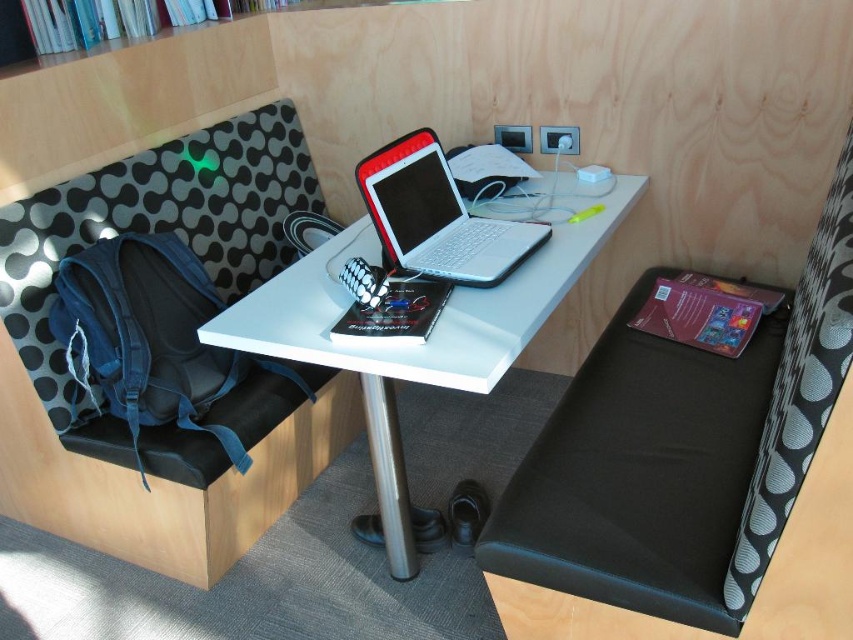
Question: Which of the following is the closest to the observer?

Choices:
 (A) (173, 202)
 (B) (616, 412)

Answer: (B)

Question: Which point is farther from the camera taking this photo?

Choices:
 (A) (814, 292)
 (B) (344, 228)
 (C) (103, 525)

Answer: (B)

Question: Can you confirm if black leather chair at lower right is bigger than white glossy computer desk at center?

Choices:
 (A) yes
 (B) no

Answer: (B)

Question: Is denim backpack at left closer to the viewer compared to black leather chair at lower right?

Choices:
 (A) yes
 (B) no

Answer: (B)

Question: Among these points, which one is farthest from the camera?

Choices:
 (A) click(x=451, y=264)
 (B) click(x=770, y=396)
 (C) click(x=453, y=358)

Answer: (A)

Question: Considering the relative positions of denim backpack at left and white glossy computer desk at center in the image provided, where is denim backpack at left located with respect to white glossy computer desk at center?

Choices:
 (A) right
 (B) left

Answer: (B)